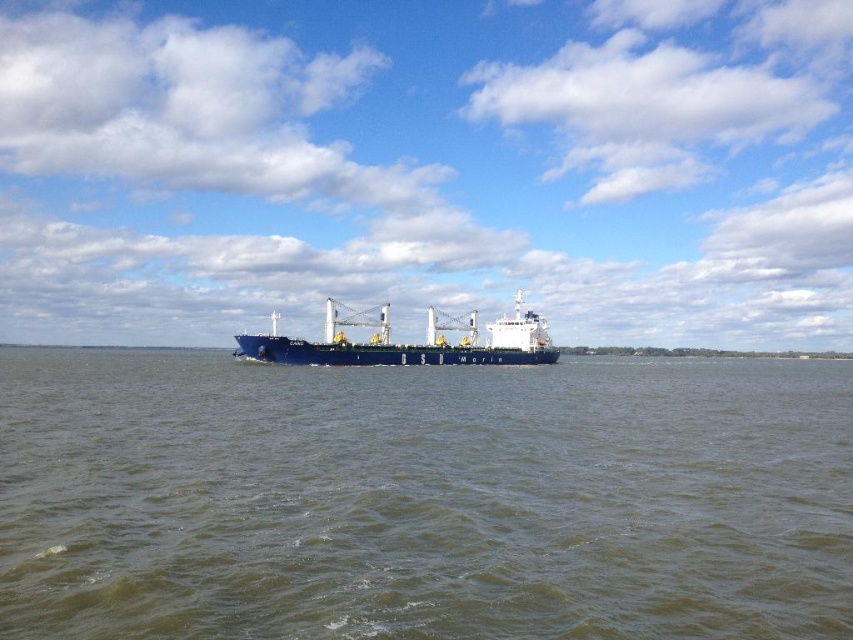
Can you confirm if brown water at center is positioned below blue matte cargo ship at center?

Yes, brown water at center is below blue matte cargo ship at center.

Which is in front, point (759, 396) or point (463, 324)?

Point (759, 396) is in front.

Does point (419, 374) come in front of point (525, 349)?

Yes.

Where is `brown water at center`? The image size is (853, 640). brown water at center is located at coordinates (422, 499).